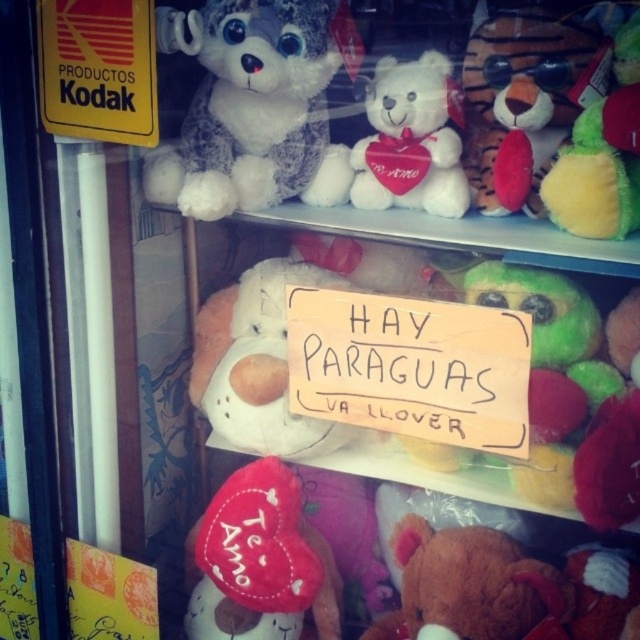
Question: Where is fluffy white teddy bear at upper center located in relation to white plush bear at center in the image?

Choices:
 (A) above
 (B) below

Answer: (A)

Question: Is yellow cardboard sign at upper left closer to the viewer compared to velvet plush toy at upper right?

Choices:
 (A) no
 (B) yes

Answer: (A)

Question: Which point is closer to the camera?

Choices:
 (A) fluffy white teddy bear at upper center
 (B) white plush bear at center

Answer: (A)

Question: Which object is positioned farthest from the velvet heart at center?

Choices:
 (A) white plush teddy bear at center
 (B) soft plush tiger at upper right
 (C) white plush bear at center

Answer: (B)

Question: Does white plush bear at center appear on the right side of black kodak sign at upper left?

Choices:
 (A) yes
 (B) no

Answer: (A)

Question: Based on their relative distances, which object is farther from the velvet heart at center?

Choices:
 (A) yellow cardboard sign at upper left
 (B) velvet plush toy at upper right
 (C) white plush teddy bear at center
 (D) black kodak sign at upper left

Answer: (B)